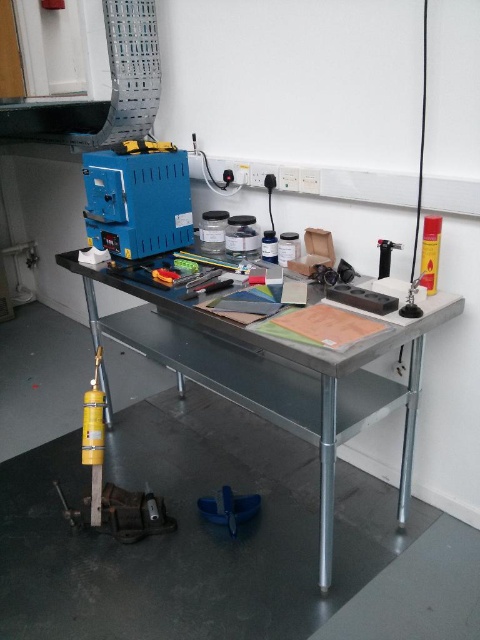
Question: Which of these objects is positioned closest to the metallic gray table at center?

Choices:
 (A) black plastic lighter at upper right
 (B) metallic silver tool at right
 (C) metallic silver tool at center

Answer: (C)

Question: Is blue plastic tool at upper left smaller than metallic silver tool at right?

Choices:
 (A) yes
 (B) no

Answer: (B)

Question: Can you confirm if metallic gray table at center is smaller than black plastic lighter at upper right?

Choices:
 (A) no
 (B) yes

Answer: (A)

Question: Observing the image, what is the correct spatial positioning of metallic silver tool at right in reference to black plastic lighter at upper right?

Choices:
 (A) left
 (B) right

Answer: (B)

Question: Estimate the real-world distances between objects in this image. Which object is farther from the black plastic lighter at upper right?

Choices:
 (A) blue plastic tool at upper left
 (B) metallic silver tool at center

Answer: (A)

Question: Which of the following is the closest to the observer?

Choices:
 (A) (228, 288)
 (B) (387, 253)

Answer: (B)